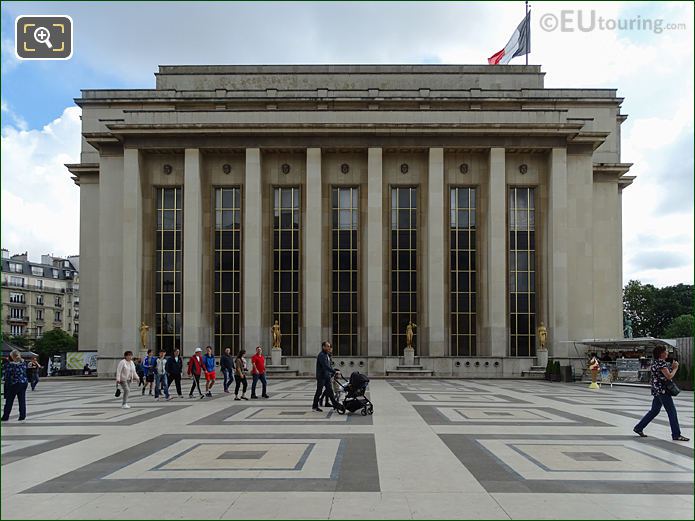
I want to click on statue, so click(274, 333).